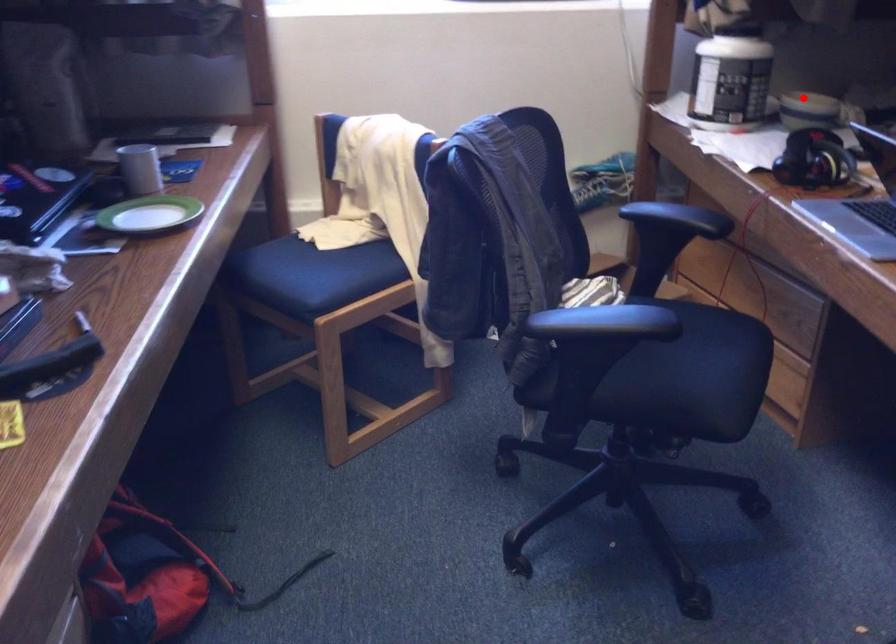
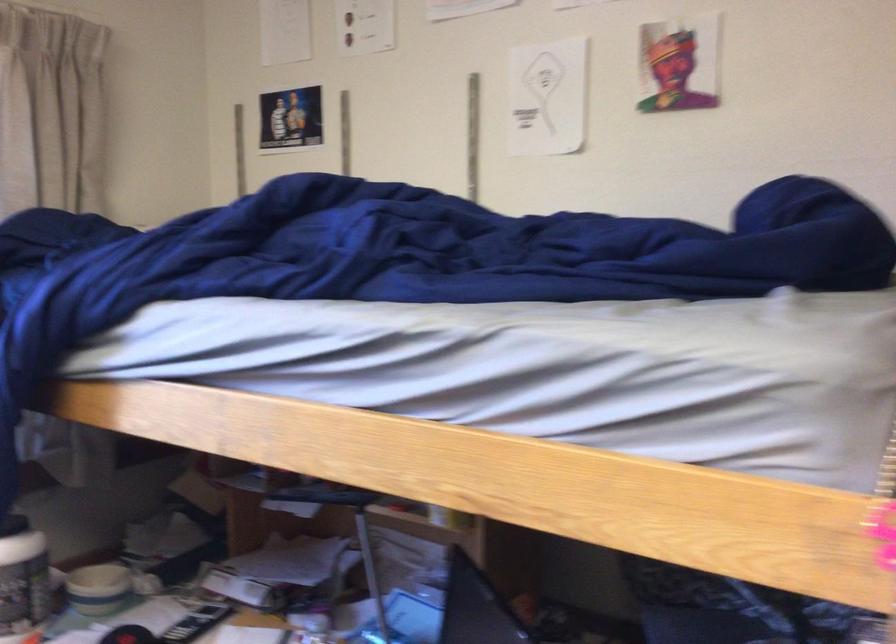
The point at the highlighted location is marked in the first image. Where is the corresponding point in the second image?

(98, 589)